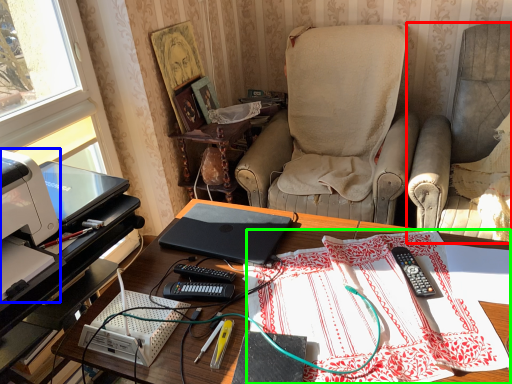
Question: Considering the real-world distances, which object is closest to chair (highlighted by a red box)? printer (highlighted by a blue box) or tablecloth (highlighted by a green box).

Choices:
 (A) printer
 (B) tablecloth

Answer: (B)